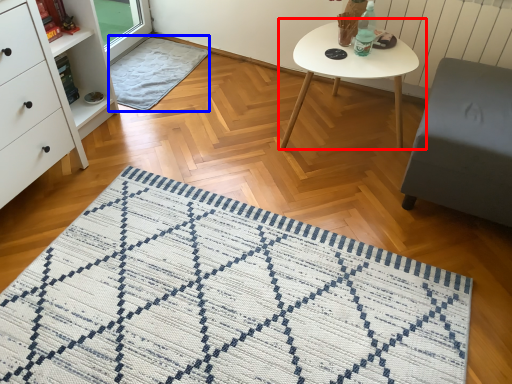
Question: Among these objects, which one is farthest to the camera, coffee table (highlighted by a red box) or blanket (highlighted by a blue box)?

Choices:
 (A) coffee table
 (B) blanket

Answer: (B)